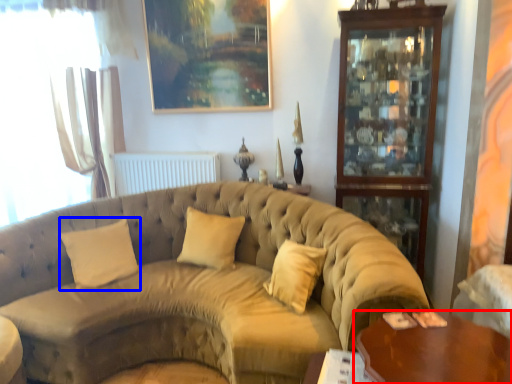
Question: Which object is further to the camera taking this photo, table (highlighted by a red box) or pillow (highlighted by a blue box)?

Choices:
 (A) table
 (B) pillow

Answer: (B)